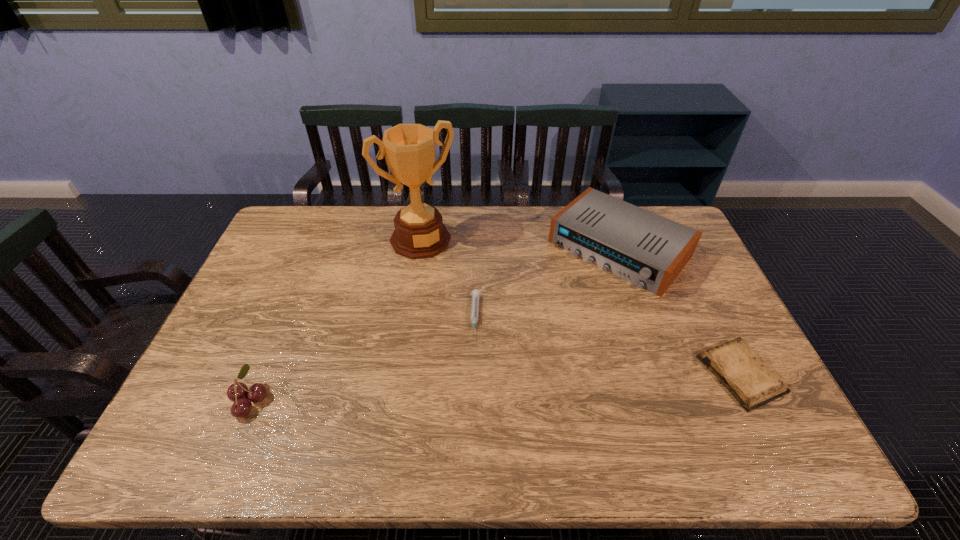
In order to click on free spot on the desktop that is between the cherry and the second shortest object and is positioned at the needle end of the shortest object in this screenshot , I will do `click(471, 388)`.

Locate an element on the screen. The width and height of the screenshot is (960, 540). vacant spot on the desktop that is between the leftmost object and the second shortest object and is positioned on the front panel of the radio receiver is located at coordinates (486, 388).

At what (x,y) coordinates should I click in order to perform the action: click on vacant spot on the desktop that is between the leftmost object and the second shortest object and is positioned on the front-facing side of the award. Please return your answer as a coordinate pair (x, y). The image size is (960, 540). Looking at the image, I should click on (510, 386).